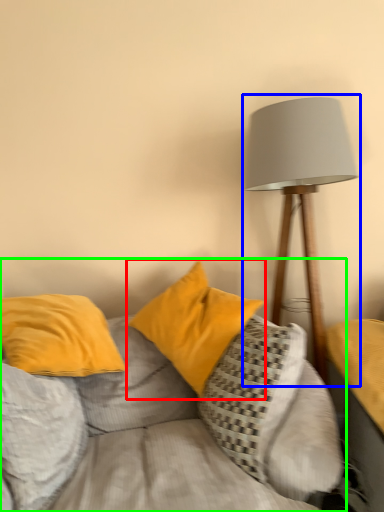
Question: Considering the real-world distances, which object is farthest from pillow (highlighted by a red box)? lamp (highlighted by a blue box) or studio couch (highlighted by a green box)?

Choices:
 (A) lamp
 (B) studio couch

Answer: (A)